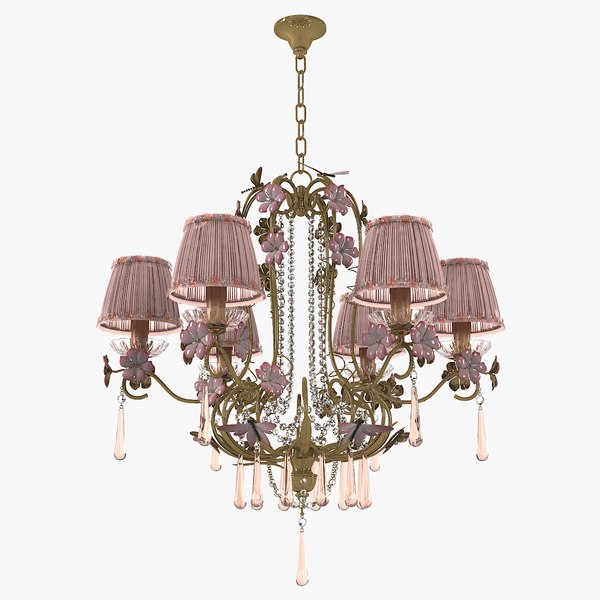
The width and height of the screenshot is (600, 600). What are the coordinates of `bottom of lamp shade` in the screenshot? It's located at (165, 318), (195, 282), (367, 285), (454, 317).